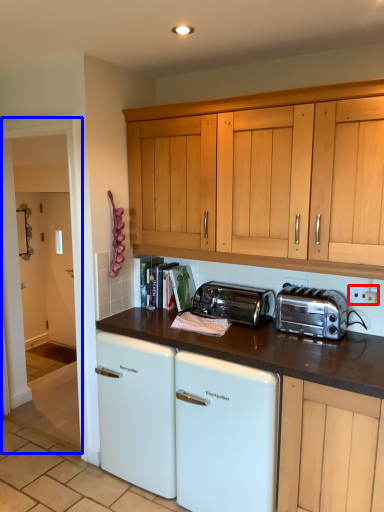
Question: Which point is further to the camera, electric outlet (highlighted by a red box) or glass door (highlighted by a blue box)?

Choices:
 (A) electric outlet
 (B) glass door

Answer: (B)